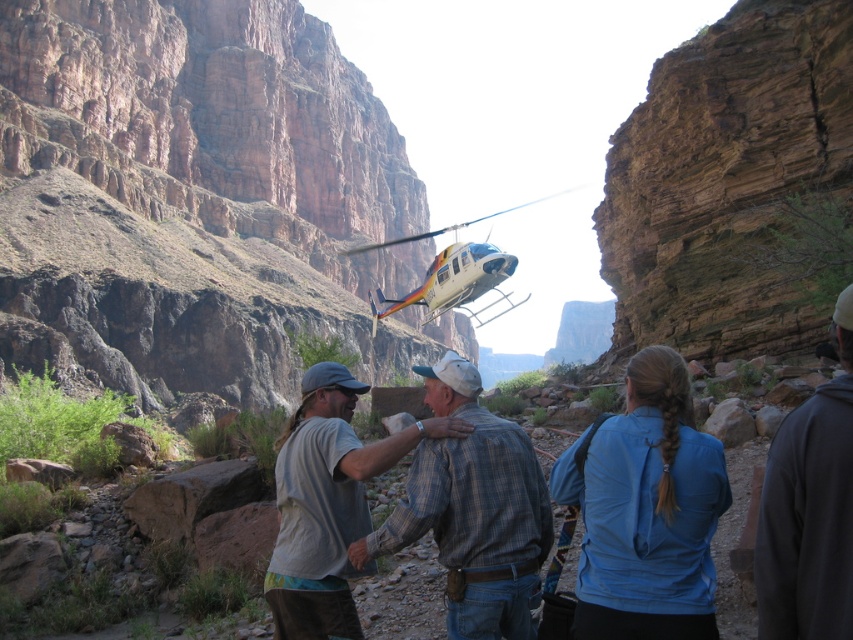
You are a hiker planning to hike through the Grand Canyon. You see the plaid fabric shirt at center and the white plastic helicopter at center in the image. Which object is narrower in width?

The plaid fabric shirt at center is thinner than the white plastic helicopter at center, so the plaid fabric shirt at center is narrower in width.

You are a hiker planning to take a photo of the plaid fabric shirt at center and the white plastic helicopter at center. Which object should you focus on first if you want to capture both in the same frame without moving the camera?

You should focus on the plaid fabric shirt at center first because it is closer to you than the white plastic helicopter at center, allowing both to be in focus when using a shallow depth of field.